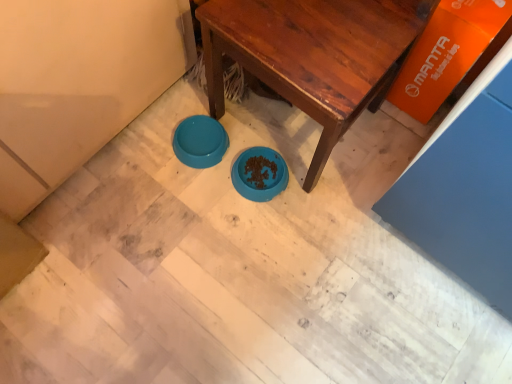
This screenshot has width=512, height=384. I want to click on vacant space to the right of teal plastic bowl at center, so click(x=256, y=132).